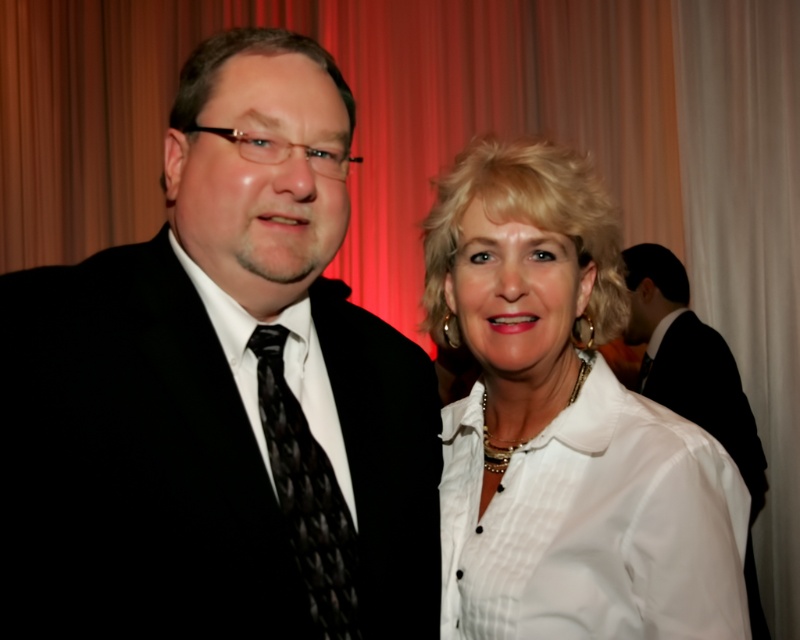
You are a photographer at a formal event and need to ensure that both the black satin suit at left and the black satin suit at right are in focus. The depth of field of your camera can cover 7 feet. Can you capture both subjects clearly in the same shot without adjusting your camera settings?

The black satin suit at left is 7.66 feet from the black satin suit at right. Since the distance between them exceeds the camera depth of field of 7 feet, you cannot capture both in focus without adjusting settings.

You are standing in front of the photograph and want to touch the two points mentioned. Which point, point (x=404, y=518) or point (x=704, y=416), is closer to your hand when you reach out?

Point (x=404, y=518) is closer to the viewer than point (x=704, y=416), so it would be closer to your hand when you reach out.

You are a photographer trying to adjust the lighting for a photo shoot. You need to ensure that both the black satin suit at left and the white satin blouse at center are evenly lit. Given their positions, which object might require more light to achieve proper exposure?

The black satin suit at left requires more light because darker colors absorb more light and may appear underexposed if not properly illuminated compared to the white satin blouse at center.